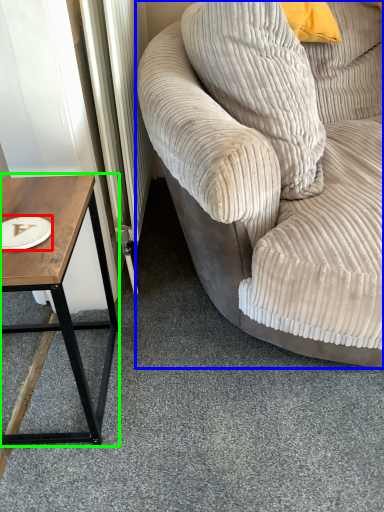
Question: Considering the real-world distances, which object is farthest from paper plate (highlighted by a red box)? studio couch (highlighted by a blue box) or coffee table (highlighted by a green box)?

Choices:
 (A) studio couch
 (B) coffee table

Answer: (A)